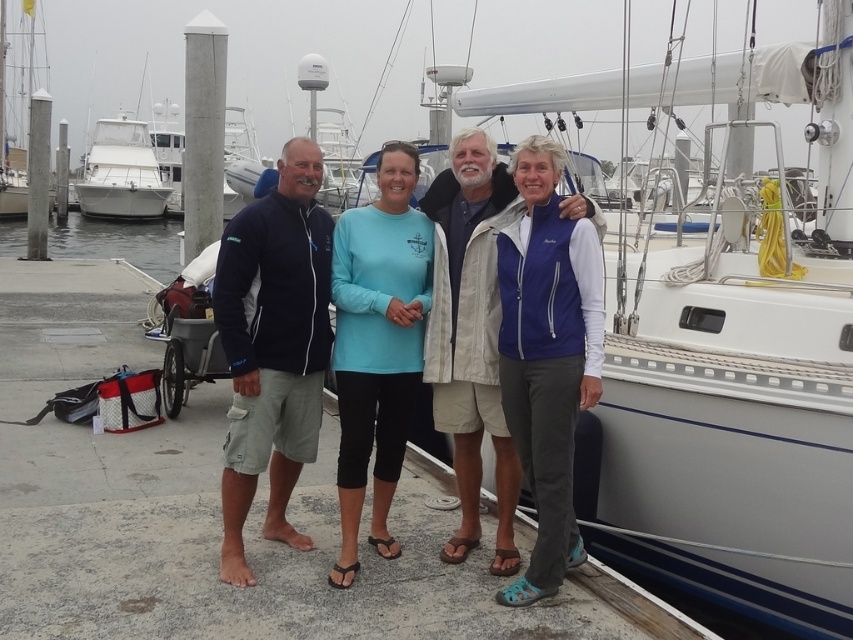
Question: Is white glossy sailboat at right closer to the viewer compared to white glossy boat at upper left?

Choices:
 (A) yes
 (B) no

Answer: (A)

Question: Estimate the real-world distances between objects in this image. Which object is farther from the matte blue jacket at center?

Choices:
 (A) clear water at dock left
 (B) teal fabric shirt at center
 (C) white glossy sailboat at right

Answer: (A)

Question: Does navy blue fleece jacket at left lie behind teal fabric shirt at center?

Choices:
 (A) yes
 (B) no

Answer: (B)

Question: Among these objects, which one is farthest from the camera?

Choices:
 (A) gray concrete dock at center
 (B) navy blue fleece jacket at left

Answer: (B)

Question: Which point is closer to the camera?

Choices:
 (A) (590, 81)
 (B) (379, 204)

Answer: (B)

Question: Is gray concrete dock at center further to the viewer compared to navy blue fleece jacket at left?

Choices:
 (A) yes
 (B) no

Answer: (B)